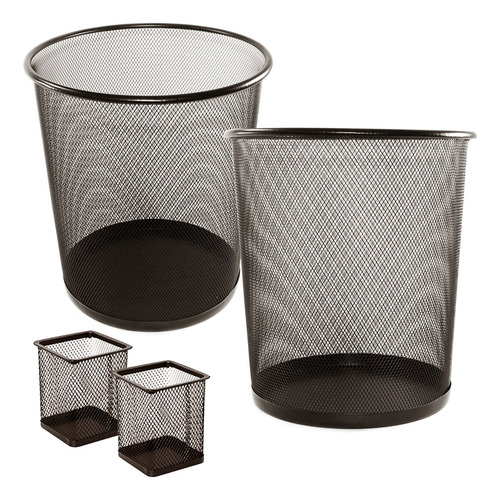
The height and width of the screenshot is (500, 500). In order to click on bottom of trash can in this screenshot , I will do `click(354, 393)`, `click(141, 271)`, `click(155, 449)`, `click(73, 422)`.